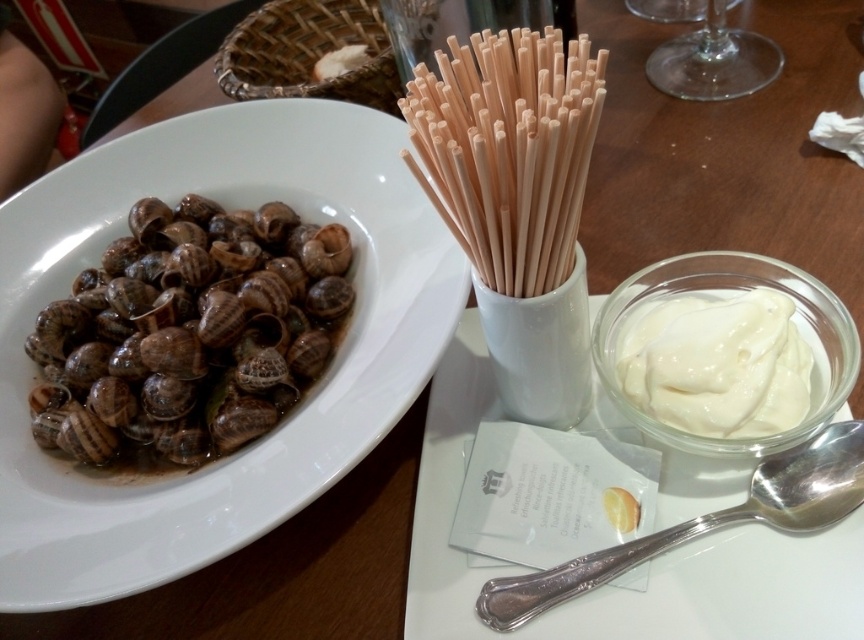
Question: Does white creamy sauce at right appear over transparent glass at upper right?

Choices:
 (A) no
 (B) yes

Answer: (A)

Question: Is matte ceramic platter at left bigger than brown striped snails at left?

Choices:
 (A) yes
 (B) no

Answer: (A)

Question: Which point appears closest to the camera in this image?

Choices:
 (A) (408, 93)
 (B) (505, 586)
 (C) (661, 45)

Answer: (B)

Question: Estimate the real-world distances between objects in this image. Which object is closer to the brown striped snails at left?

Choices:
 (A) white creamy sauce at right
 (B) matte ceramic platter at left

Answer: (B)

Question: Can you confirm if matte ceramic platter at left is positioned to the left of brown striped snails at left?

Choices:
 (A) yes
 (B) no

Answer: (B)

Question: Among these objects, which one is farthest from the camera?

Choices:
 (A) matte ceramic platter at left
 (B) silver metallic spoon at upper right
 (C) brown striped snails at left

Answer: (C)